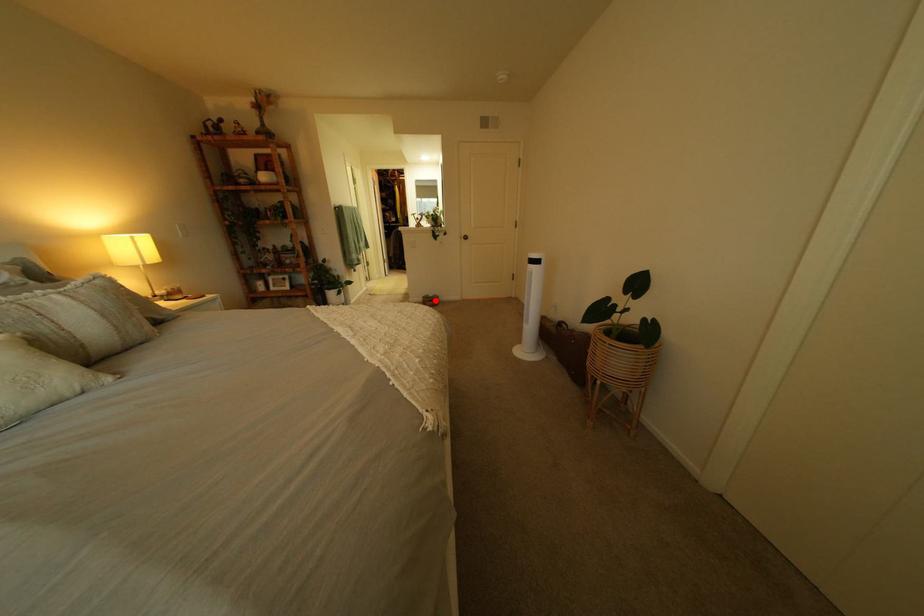
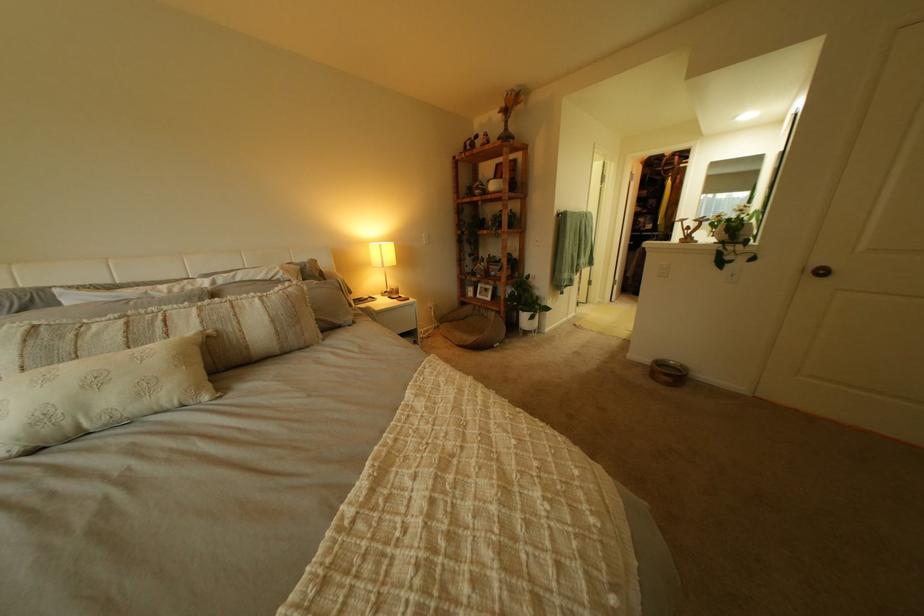
Where in the second image is the point corresponding to the highlighted location from the first image?

(663, 362)